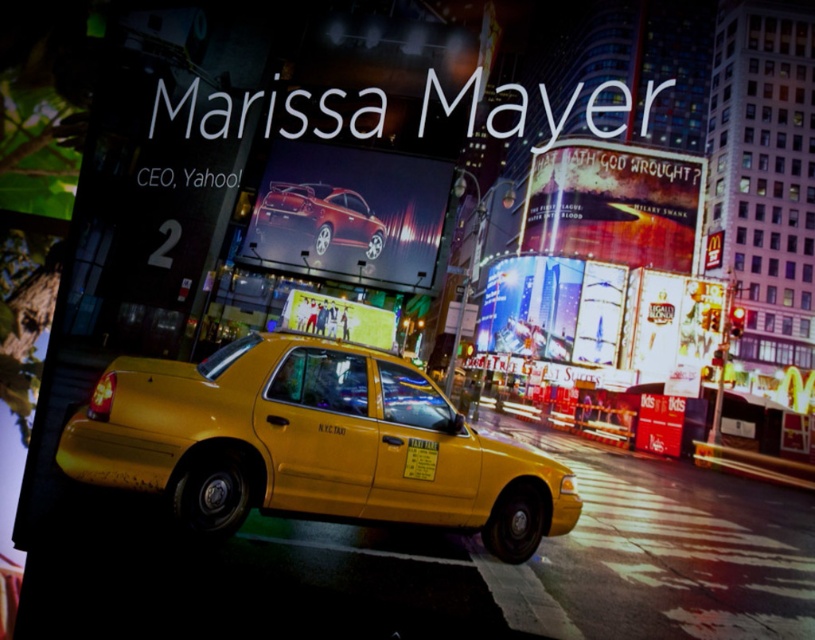
Question: Which point is farther to the camera?

Choices:
 (A) shiny red car at center
 (B) shiny metallic skyscrapers at center
 (C) shiny metallic car at center
 (D) shiny yellow taxi at center

Answer: (B)

Question: Is shiny yellow taxi at center behind shiny metallic skyscrapers at center?

Choices:
 (A) no
 (B) yes

Answer: (A)

Question: Can you confirm if shiny yellow taxi at center is wider than white glossy billboard at center?

Choices:
 (A) yes
 (B) no

Answer: (A)

Question: Considering the real-world distances, which object is farthest from the matte white billboard at upper right?

Choices:
 (A) shiny metallic skyscrapers at center
 (B) shiny red car at center
 (C) shiny yellow taxi at center
 (D) white glossy billboard at center

Answer: (D)

Question: Which object is the closest to the shiny yellow taxi at center?

Choices:
 (A) shiny metallic skyscrapers at center
 (B) matte white billboard at upper right
 (C) shiny red car at center
 (D) white glossy billboard at center

Answer: (C)

Question: Does shiny red car at center have a larger size compared to white glossy billboard at center?

Choices:
 (A) yes
 (B) no

Answer: (A)